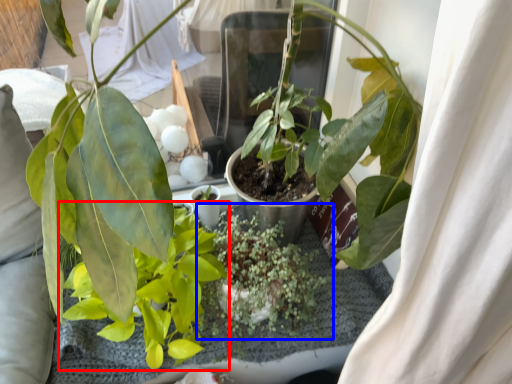
Question: Which point is closer to the camera, houseplant (highlighted by a red box) or houseplant (highlighted by a blue box)?

Choices:
 (A) houseplant
 (B) houseplant

Answer: (A)